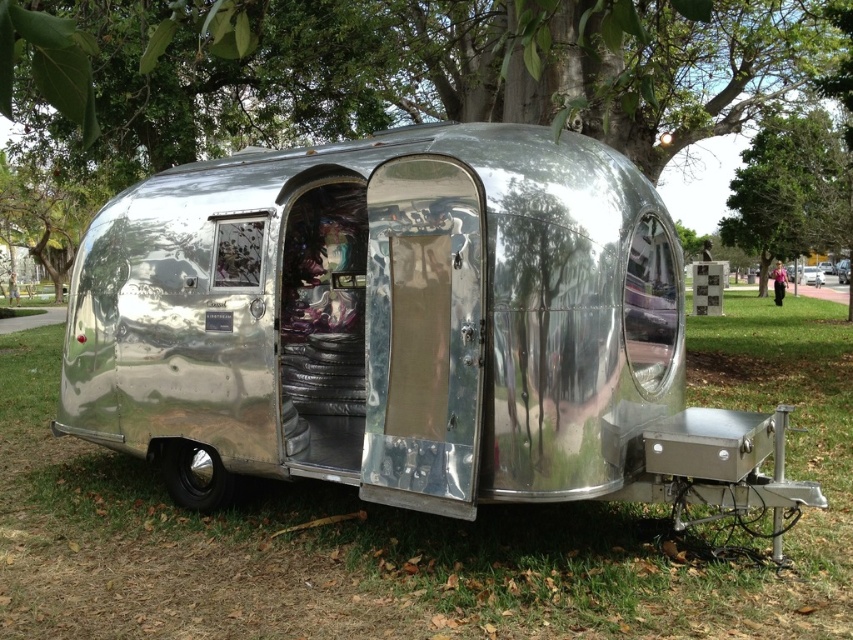
You are standing in front of the vintage Airstream trailer and notice the green grass at lower center and the green leafy tree at upper center. Which object is shorter?

The green grass at lower center is shorter than the green leafy tree at upper center.

You are standing in front of the vintage Airstream trailer and notice the green grass at lower center and the green leafy tree at upper center. Which of these two objects is nearer to you?

The green grass at lower center is closer to the viewer than the green leafy tree at upper center.

You are standing in front of the vintage Airstream trailer and notice a point marked at coordinates (x=448, y=67). What object does this point correspond to?

The point at coordinates (x=448, y=67) corresponds to the glossy bark tree at upper center.